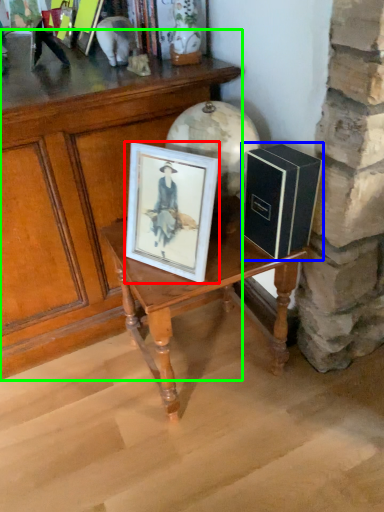
Question: Considering the real-world distances, which object is farthest from picture frame (highlighted by a red box)? book (highlighted by a blue box) or table (highlighted by a green box)?

Choices:
 (A) book
 (B) table

Answer: (B)